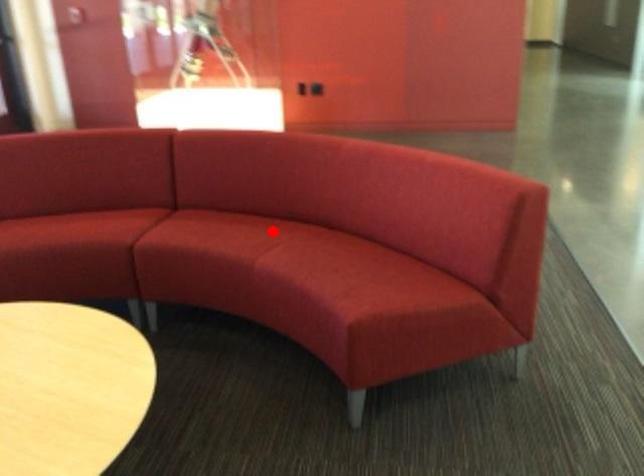
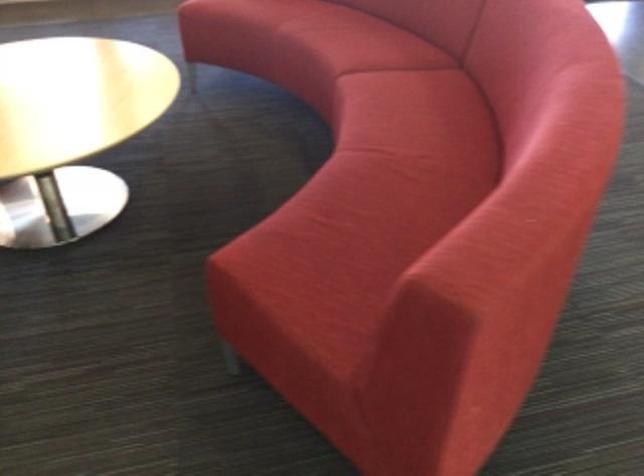
Question: I am providing you with two images of the same scene from different viewpoints. A red point is shown in image1. For the corresponding object point in image2, is it positioned nearer or farther from the camera?

Choices:
 (A) Nearer
 (B) Farther

Answer: (A)